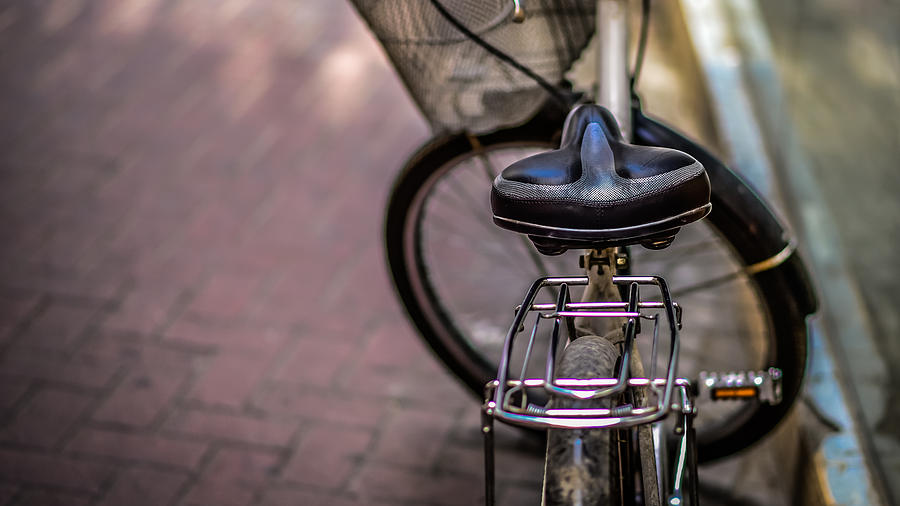
Locate an element on the screen. floor is located at coordinates (295, 338).